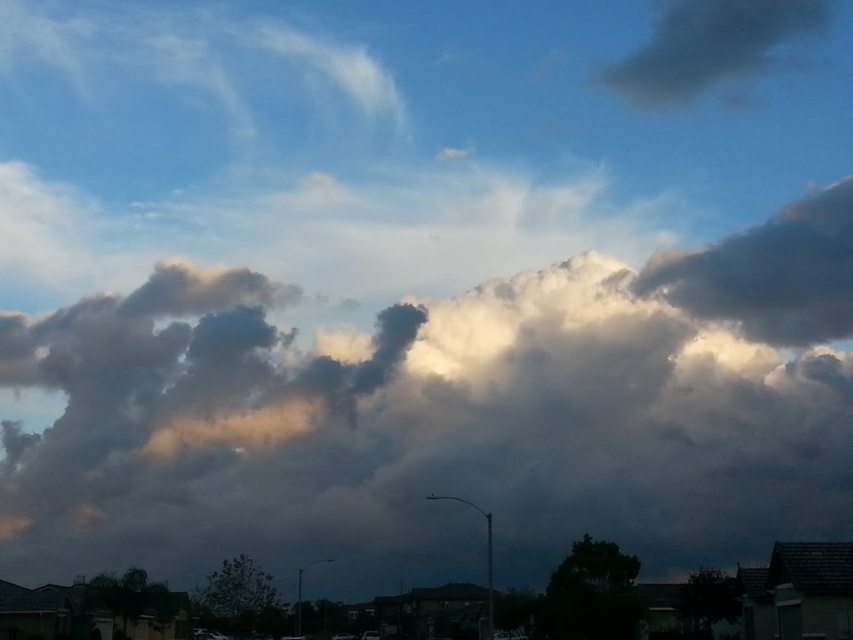
You are standing on the ground and looking at the dark gray cloud at upper right. If you want to take a photo of it with your camera, which is 1.5 meters tall, will the camera be able to capture the entire cloud in the frame without moving?

The dark gray cloud at upper right and camera are 226.22 meters apart. Since the camera is only 1.5 meters tall, it can easily capture the entire cloud in the frame without needing to move, as the distance is sufficient for the camera to include the cloud within its field of view.

You are an astronomer observing the sky and notice the cloudy at upper center and the dark gray cloud at upper right. Which cloud is taller in the sky?

The cloudy at upper center is taller than the dark gray cloud at upper right according to the description.